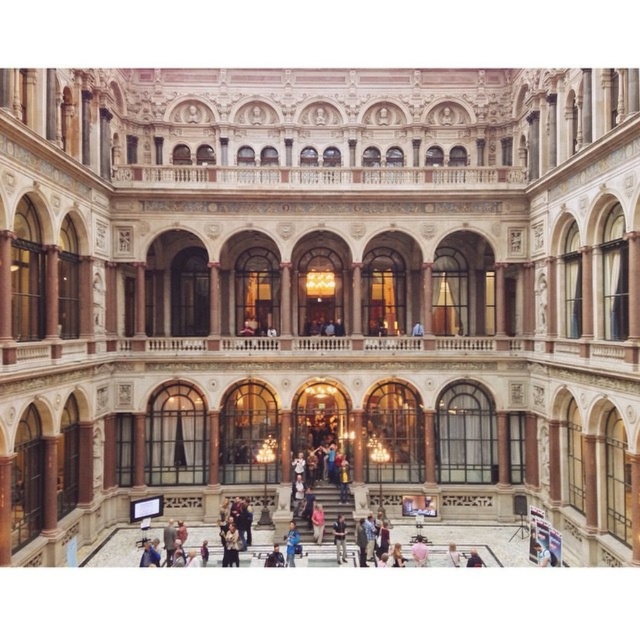
Question: Which object is farther from the camera taking this photo?

Choices:
 (A) brown fur coat at lower center
 (B) light brown leather jacket at lower center

Answer: (A)

Question: Does brown fur coat at lower center appear on the left side of dark blue shirt at center?

Choices:
 (A) no
 (B) yes

Answer: (B)

Question: Which point is farther to the camera?

Choices:
 (A) (340, 556)
 (B) (291, 540)

Answer: (A)

Question: Does dark blue shirt at center have a larger size compared to light brown leather jacket at lower center?

Choices:
 (A) yes
 (B) no

Answer: (A)

Question: Which object is positioned farthest from the light brown leather jacket at lower center?

Choices:
 (A) dark blue shirt at center
 (B) brown fur coat at lower center

Answer: (B)

Question: Is dark blue shirt at center wider than light brown leather jacket at lower center?

Choices:
 (A) no
 (B) yes

Answer: (A)